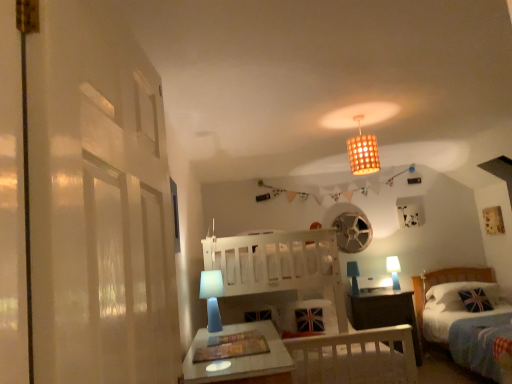
Question: Which direction should I rotate to look at blue fabric table lamp at center, which appears as the 2th table lamp when viewed from the front, — up or down?

Choices:
 (A) up
 (B) down

Answer: (B)

Question: From a real-world perspective, is white wooden bunk bed at center physically above blue fabric table lamp at center, the second table lamp when ordered from left to right?

Choices:
 (A) no
 (B) yes

Answer: (A)

Question: Is white wooden bunk bed at center turned away from blue fabric table lamp at center, the second table lamp when ordered from left to right?

Choices:
 (A) yes
 (B) no

Answer: (B)

Question: Does white wooden bunk bed at center have a lesser width compared to blue fabric table lamp at center, placed as the second table lamp when sorted from right to left?

Choices:
 (A) yes
 (B) no

Answer: (B)

Question: Is white wooden bunk bed at center not close to blue fabric table lamp at center, which appears as the 2th table lamp when viewed from the front?

Choices:
 (A) yes
 (B) no

Answer: (A)

Question: Is white wooden bunk bed at center wider than blue fabric table lamp at center, which appears as the 2th table lamp when viewed from the front?

Choices:
 (A) yes
 (B) no

Answer: (A)

Question: Does white wooden bunk bed at center have a larger size compared to blue fabric table lamp at center, the second table lamp when ordered from left to right?

Choices:
 (A) no
 (B) yes

Answer: (B)

Question: Is blue fabric table lamp at center, placed as the second table lamp when sorted from right to left, not near union jack fabric pillow at lower right?

Choices:
 (A) yes
 (B) no

Answer: (A)

Question: Is the depth of blue fabric table lamp at center, placed as the second table lamp when sorted from right to left, greater than that of union jack fabric pillow at lower right?

Choices:
 (A) yes
 (B) no

Answer: (A)

Question: Is union jack fabric pillow at lower right completely or partially inside blue fabric table lamp at center, placed as the second table lamp when sorted from right to left?

Choices:
 (A) no
 (B) yes

Answer: (A)

Question: Does blue fabric table lamp at center, placed as the second table lamp when sorted from right to left, have a greater width compared to union jack fabric pillow at lower right?

Choices:
 (A) no
 (B) yes

Answer: (A)

Question: From the image's perspective, is blue fabric table lamp at center, the second table lamp when ordered from left to right, under union jack fabric pillow at lower right?

Choices:
 (A) yes
 (B) no

Answer: (B)

Question: Is blue fabric table lamp at center, placed as the second table lamp when sorted from right to left, smaller than union jack fabric pillow at lower right?

Choices:
 (A) yes
 (B) no

Answer: (A)

Question: Does bamboo woven lampshade at upper center have a lesser width compared to blue fabric lampshade at lower center, the third table lamp positioned from the right?

Choices:
 (A) no
 (B) yes

Answer: (A)